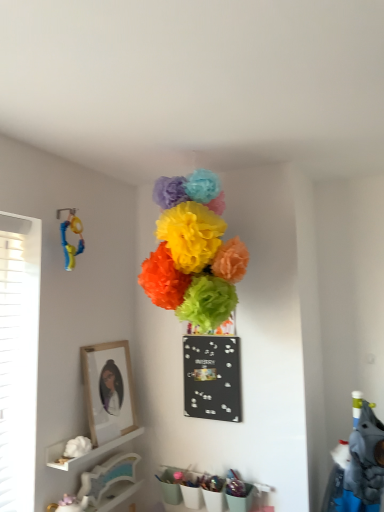
What do you see at coordinates (77, 447) in the screenshot? I see `white matte flower at lower left, the third flower when ordered from top to bottom` at bounding box center [77, 447].

This screenshot has width=384, height=512. I want to click on white matte flower at lower left, the third flower when ordered from top to bottom, so click(77, 447).

Measure the distance between point (x=199, y=394) and camera.

2.14 meters.

What is the approximate width of white glossy shelf at lower left?

white glossy shelf at lower left is 3.90 inches in width.

What do you see at coordinates (193, 252) in the screenshot? Image resolution: width=384 pixels, height=512 pixels. I see `bright tissue paper flowers at center, the first flower viewed from the top` at bounding box center [193, 252].

Find the location of `rubberized yellow and blue toy at left`. rubberized yellow and blue toy at left is located at coordinates pyautogui.click(x=70, y=244).

What are the coordinates of `bulletin board that appears below the green tissue paper at center, the 2th flower positioned from the bottom (from a real-world perspective)` in the screenshot? It's located at (212, 377).

Considering the sizes of objects green tissue paper at center, which is the third flower in left-to-right order, and black matte bulletin board at center in the image provided, who is smaller, green tissue paper at center, which is the third flower in left-to-right order, or black matte bulletin board at center?

green tissue paper at center, which is the third flower in left-to-right order.

Considering the relative sizes of green tissue paper at center, which is the third flower in left-to-right order, and black matte bulletin board at center in the image provided, is green tissue paper at center, which is the third flower in left-to-right order, taller than black matte bulletin board at center?

In fact, green tissue paper at center, which is the third flower in left-to-right order, may be shorter than black matte bulletin board at center.

From a real-world perspective, is green tissue paper at center, which is the third flower in left-to-right order, below black matte bulletin board at center?

Actually, green tissue paper at center, which is the third flower in left-to-right order, is physically above black matte bulletin board at center in the real world.

Between white matte flower at lower left, the third flower when ordered from top to bottom, and green tissue paper at center, which appears as the first flower when viewed from the right, which one has larger width?

white matte flower at lower left, the third flower when ordered from top to bottom, is wider.

Who is bigger, white matte flower at lower left, which appears as the 3th flower when viewed from the right, or green tissue paper at center, which appears as the first flower when viewed from the right?

green tissue paper at center, which appears as the first flower when viewed from the right.

Is white matte flower at lower left, which appears as the 3th flower when viewed from the right, positioned far away from green tissue paper at center, the 2th flower positioned from the bottom?

No, white matte flower at lower left, which appears as the 3th flower when viewed from the right, is not far from green tissue paper at center, the 2th flower positioned from the bottom.

At what (x,y) coordinates should I click in order to perform the action: click on the 1st flower above the white matte flower at lower left, the third flower when ordered from top to bottom (from a real-world perspective). Please return your answer as a coordinate pair (x, y). Looking at the image, I should click on (207, 303).

Is white glossy shelf at lower left oriented towards bright tissue paper flowers at center, the 2th flower positioned from the right?

No, white glossy shelf at lower left is not aimed at bright tissue paper flowers at center, the 2th flower positioned from the right.

Does white glossy shelf at lower left have a smaller size compared to bright tissue paper flowers at center, which appears as the 3th flower when ordered from the bottom?

Indeed, white glossy shelf at lower left has a smaller size compared to bright tissue paper flowers at center, which appears as the 3th flower when ordered from the bottom.

What's the angular difference between white glossy shelf at lower left and bright tissue paper flowers at center, the 2th flower positioned from the right,'s facing directions?

The angle between the facing direction of white glossy shelf at lower left and the facing direction of bright tissue paper flowers at center, the 2th flower positioned from the right, is 83.7 degrees.

Can you confirm if white glossy shelf at lower left is wider than white matte flower at lower left, the 1th flower when ordered from bottom to top?

In fact, white glossy shelf at lower left might be narrower than white matte flower at lower left, the 1th flower when ordered from bottom to top.

From the picture: What's the angular difference between white glossy shelf at lower left and white matte flower at lower left, which appears as the 3th flower when viewed from the right,'s facing directions?

They differ by 1.37 degrees in their facing directions.

Looking at this image, is white glossy shelf at lower left bigger than white matte flower at lower left, the 1th flower when ordered from bottom to top?

Yes, white glossy shelf at lower left is bigger than white matte flower at lower left, the 1th flower when ordered from bottom to top.

Considering the positions of objects white glossy shelf at lower left and white matte flower at lower left, which appears as the 3th flower when viewed from the right, in the image provided, who is in front, white glossy shelf at lower left or white matte flower at lower left, which appears as the 3th flower when viewed from the right,?

white matte flower at lower left, which appears as the 3th flower when viewed from the right, is in front.

From the image's perspective, is white glossy shelf at lower left beneath wooden framed portrait at left?

Yes, from the image's perspective, white glossy shelf at lower left is beneath wooden framed portrait at left.

Is point (116, 475) positioned before point (112, 408)?

Yes.

Looking at this image, which is more to the right, white glossy shelf at lower left or wooden framed portrait at left?

white glossy shelf at lower left is more to the right.

Who is shorter, white glossy shelf at lower left or wooden framed portrait at left?

Standing shorter between the two is white glossy shelf at lower left.

Considering the relative sizes of rubberized yellow and blue toy at left and wooden framed portrait at left in the image provided, is rubberized yellow and blue toy at left thinner than wooden framed portrait at left?

No, rubberized yellow and blue toy at left is not thinner than wooden framed portrait at left.

Consider the image. Is rubberized yellow and blue toy at left spatially inside wooden framed portrait at left, or outside of it?

rubberized yellow and blue toy at left exists outside the volume of wooden framed portrait at left.

Between rubberized yellow and blue toy at left and wooden framed portrait at left, which one appears on the right side from the viewer's perspective?

Positioned to the right is wooden framed portrait at left.

Can you tell me how much rubberized yellow and blue toy at left and wooden framed portrait at left differ in facing direction?

1.96 degrees.

Is wooden framed portrait at left positioned beyond the bounds of white matte flower at lower left, the third flower when ordered from top to bottom?

Yes, wooden framed portrait at left is outside of white matte flower at lower left, the third flower when ordered from top to bottom.

Is point (125, 408) behind point (80, 444)?

Yes, point (125, 408) is farther from viewer.

From a real-world perspective, is wooden framed portrait at left positioned over white matte flower at lower left, which appears as the 3th flower when viewed from the right, based on gravity?

Indeed, from a real-world perspective, wooden framed portrait at left stands above white matte flower at lower left, which appears as the 3th flower when viewed from the right.

Is wooden framed portrait at left touching white matte flower at lower left, the 1th flower when ordered from bottom to top?

wooden framed portrait at left and white matte flower at lower left, the 1th flower when ordered from bottom to top, are not in contact.

This screenshot has width=384, height=512. Find the location of `bulletin board in front of the green tissue paper at center, which appears as the first flower when viewed from the right`. bulletin board in front of the green tissue paper at center, which appears as the first flower when viewed from the right is located at coordinates (212, 377).

Locate an element on the screen. Image resolution: width=384 pixels, height=512 pixels. flower lying behind the white matte flower at lower left, which appears as the 3th flower when viewed from the right is located at coordinates (207, 303).

Based on the photo, from the image, which object appears to be nearer to green tissue paper at center, the 2th flower positioned from the bottom, white matte flower at lower left, which appears as the 3th flower when viewed from the right, or bright tissue paper flowers at center, which appears as the 3th flower when ordered from the bottom?

bright tissue paper flowers at center, which appears as the 3th flower when ordered from the bottom, is closer to green tissue paper at center, the 2th flower positioned from the bottom.

Which object lies nearer to the anchor point black matte bulletin board at center, white matte shelf at lower left or wooden framed portrait at left?

Based on the image, wooden framed portrait at left appears to be nearer to black matte bulletin board at center.

Estimate the real-world distances between objects in this image. Which object is closer to white glossy shelf at lower left, green tissue paper at center, which appears as the first flower when viewed from the right, or white matte shelf at lower left?

Based on the image, white matte shelf at lower left appears to be nearer to white glossy shelf at lower left.

Estimate the real-world distances between objects in this image. Which object is further from bright tissue paper flowers at center, the 2th flower positioned from the right, rubberized yellow and blue toy at left or black matte bulletin board at center?

rubberized yellow and blue toy at left is positioned further to the anchor bright tissue paper flowers at center, the 2th flower positioned from the right.

Estimate the real-world distances between objects in this image. Which object is closer to black matte bulletin board at center, green tissue paper at center, which is the third flower in left-to-right order, or white matte shelf at lower left?

Among the two, green tissue paper at center, which is the third flower in left-to-right order, is located nearer to black matte bulletin board at center.

Looking at the image, which one is located further to white matte shelf at lower left, black matte bulletin board at center or green tissue paper at center, positioned as the 2th flower in top-to-bottom order?

Based on the image, green tissue paper at center, positioned as the 2th flower in top-to-bottom order, appears to be further to white matte shelf at lower left.

When comparing their distances from white glossy shelf at lower left, does white matte shelf at lower left or wooden framed portrait at left seem further?

The object further to white glossy shelf at lower left is wooden framed portrait at left.

From the picture: Estimate the real-world distances between objects in this image. Which object is closer to rubberized yellow and blue toy at left, wooden framed portrait at left or green tissue paper at center, which is the third flower in left-to-right order?

The object closer to rubberized yellow and blue toy at left is wooden framed portrait at left.

This screenshot has height=512, width=384. In order to click on flower between wooden framed portrait at left and white matte shelf at lower left from top to bottom in this screenshot , I will do `click(77, 447)`.

You are a GUI agent. You are given a task and a screenshot of the screen. Output one action in this format:
    pyautogui.click(x=<x>, y=<y>)
    Task: Click on the furniture between white matte flower at lower left, which appears as the 1th flower when viewed from the left, and black matte bulletin board at center
    
    Given the screenshot: What is the action you would take?
    pyautogui.click(x=109, y=483)

This screenshot has height=512, width=384. Find the location of `flower between wooden framed portrait at left and white glossy shelf at lower left in the vertical direction`. flower between wooden framed portrait at left and white glossy shelf at lower left in the vertical direction is located at coordinates (77, 447).

Where is `shelf between rubberized yellow and blue toy at left and white glossy shelf at lower left in the up-down direction`? Image resolution: width=384 pixels, height=512 pixels. shelf between rubberized yellow and blue toy at left and white glossy shelf at lower left in the up-down direction is located at coordinates (87, 453).